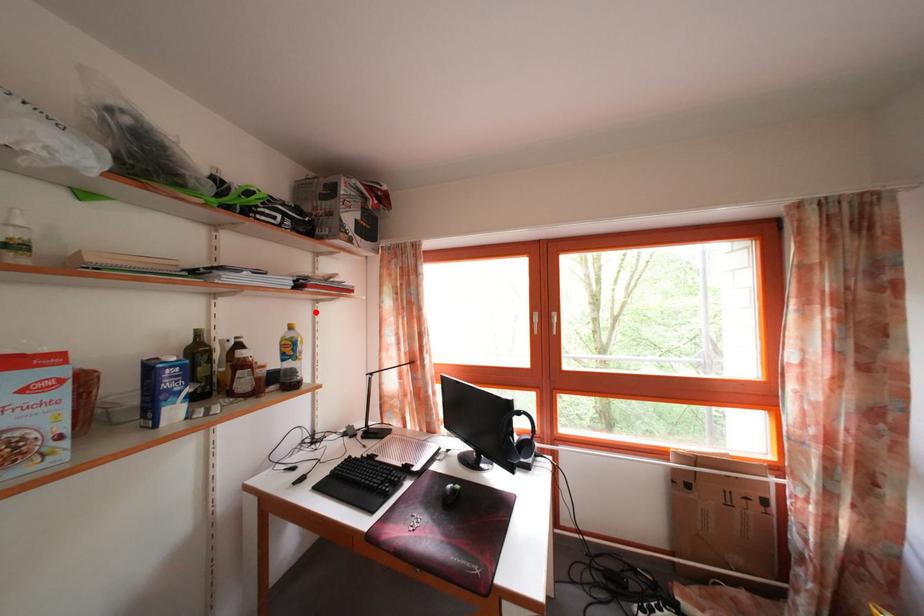
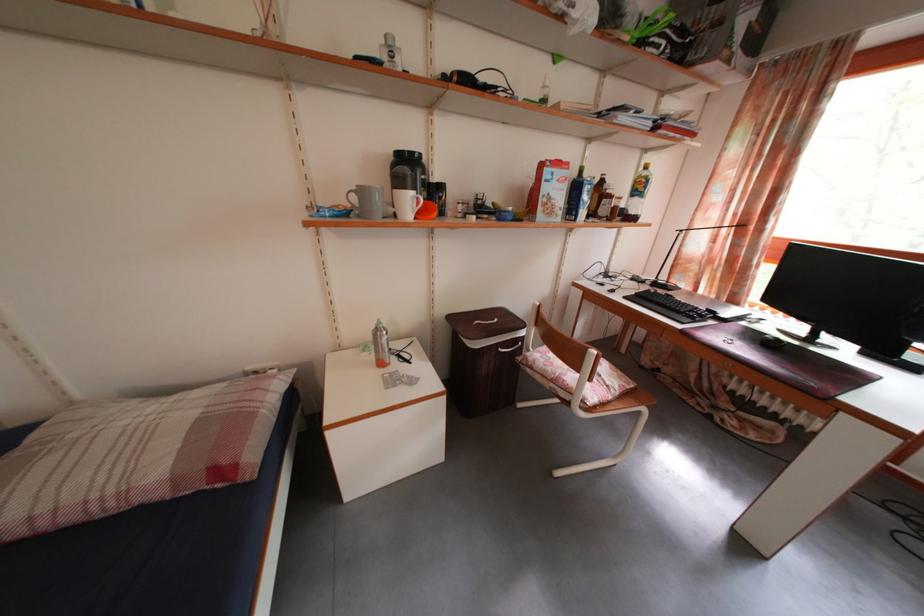
Locate, in the second image, the point that corresponds to the highlighted location in the first image.

(643, 161)